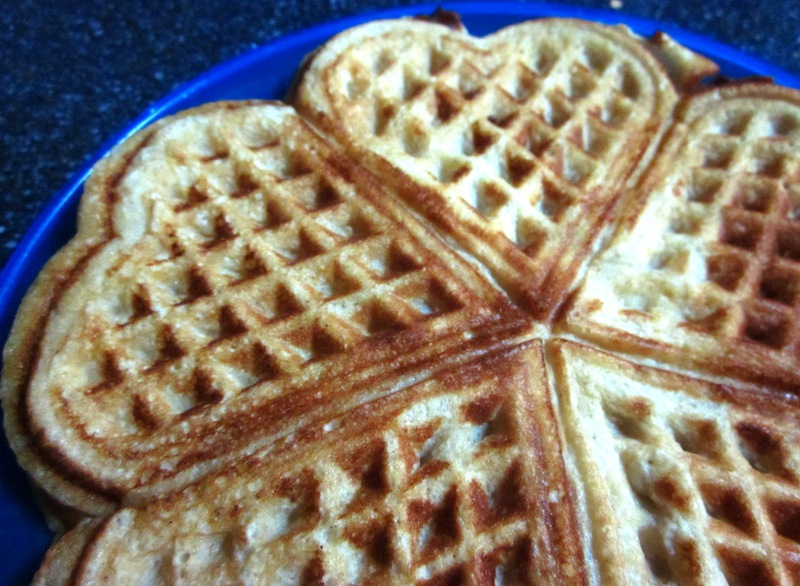
At what (x,y) coordinates should I click in order to perform the action: click on counter. Please return your answer as a coordinate pair (x, y). Looking at the image, I should click on (58, 146).